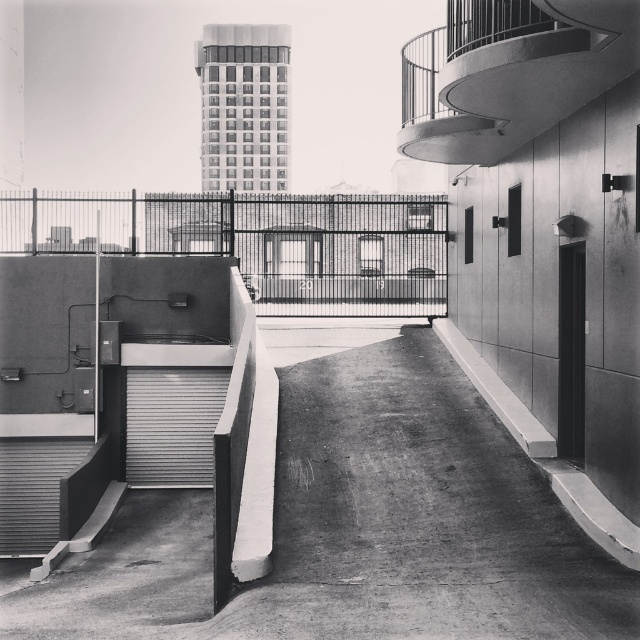
You are on the rooftop and want to descend to the lower level. You see a metallic spiral staircase at upper right and a metallic gray stairwell at lower left. Which one is closer to the gate with the number 20 on its left side?

The metallic gray stairwell at lower left is closer to the gate with the number 20 on its left side because the metallic spiral staircase at upper right is to the right of the metallic gray stairwell at lower left, placing it farther away from the gate.

You are on a rooftop and want to descend to the ground level. You see a metallic spiral staircase at upper right and a metallic gray stairwell at lower left. Which one is closer to you?

The metallic spiral staircase at upper right is closer to you since it is in front of the metallic gray stairwell at lower left.

You are a maintenance worker needing to access the roof. You see the metallic spiral staircase at upper right and the metallic silver door at lower left. Which one is above the other?

The metallic spiral staircase at upper right is positioned over the metallic silver door at lower left.